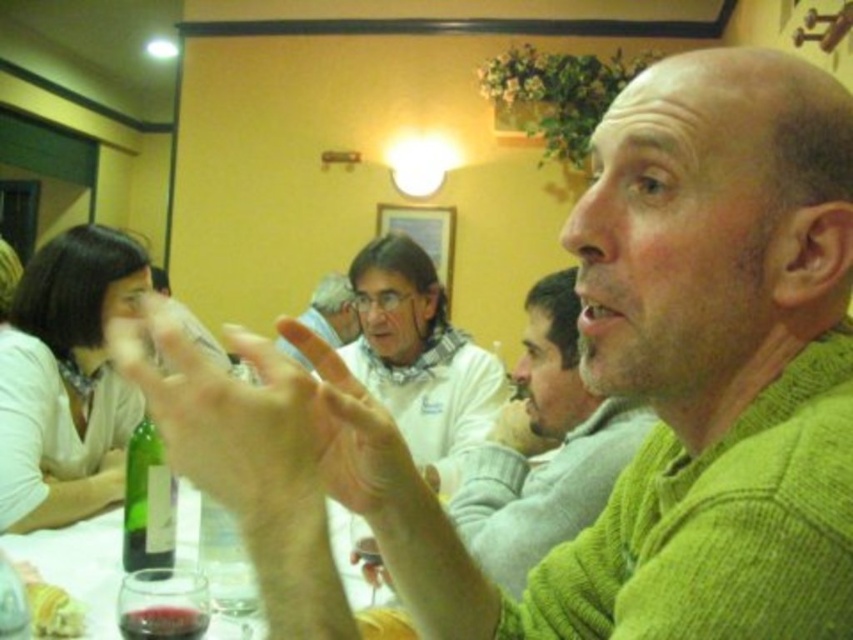
Between translucent plastic wine glass at center and green glass bottle at lower left, which one has more height?

green glass bottle at lower left is taller.

Can you confirm if translucent plastic wine glass at center is positioned above green glass bottle at lower left?

Indeed, translucent plastic wine glass at center is positioned over green glass bottle at lower left.

The width and height of the screenshot is (853, 640). Identify the location of translucent plastic wine glass at center. (233, 419).

Between matte white shirt at center and yellow fluffy bread at lower left, which one is positioned lower?

yellow fluffy bread at lower left is lower down.

Between point (323, 294) and point (45, 632), which one is positioned behind?

Point (323, 294)

Which is in front, point (315, 321) or point (35, 611)?

Point (35, 611) is in front.

Identify the location of matte white shirt at center. (332, 310).

Does green knitted sweater at upper right come in front of matte white shirt at center?

That is True.

Does point (566, 344) come farther from viewer compared to point (308, 307)?

No, it is not.

Who is more forward, (606, 429) or (345, 332)?

Point (606, 429)

Locate an element on the screen. This screenshot has height=640, width=853. green knitted sweater at upper right is located at coordinates (541, 448).